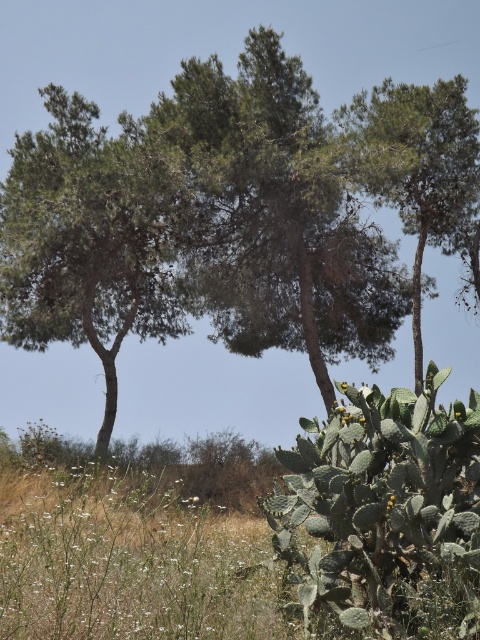
Can you confirm if green leafy tree at center is taller than green leafy tree at upper center?

Yes.

The width and height of the screenshot is (480, 640). Identify the location of green leafy tree at center. pos(218,268).

What are the coordinates of `green leafy tree at center` in the screenshot? It's located at (218, 268).